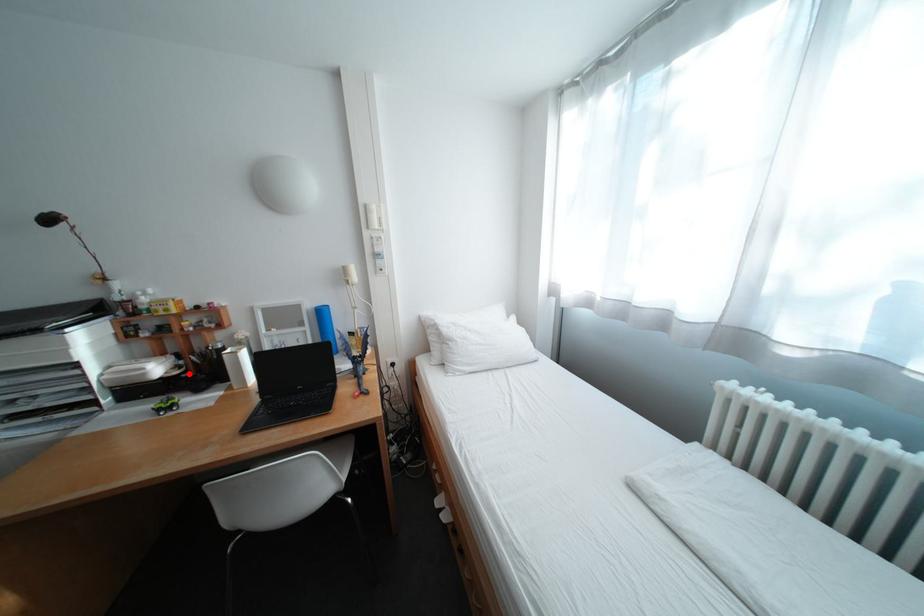
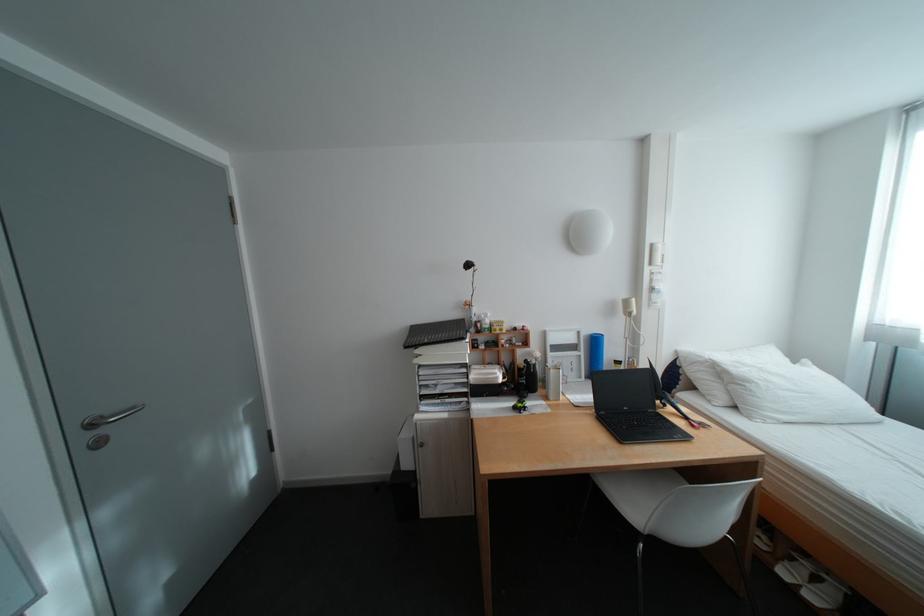
The point at the highlighted location is marked in the first image. Where is the corresponding point in the second image?

(518, 381)